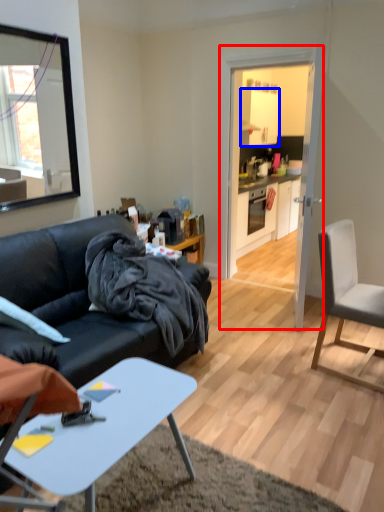
Question: Which object appears farthest to the camera in this image, glass door (highlighted by a red box) or cabinetry (highlighted by a blue box)?

Choices:
 (A) glass door
 (B) cabinetry

Answer: (B)